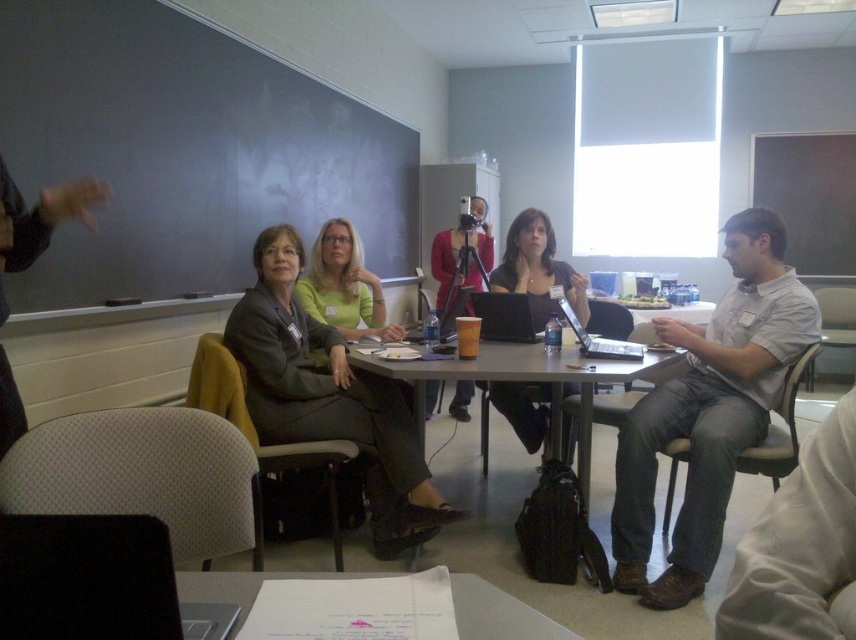
You are a photographer setting up for a group photo in the classroom. You need to ensure that the person wearing the matte gray suit at center and the person wearing the matte green shirt at center are both visible in the frame. Considering their heights, which of the two should be seated closer to the back to avoid blocking the view of the other?

The matte gray suit at center has a greater height compared to matte green shirt at center. Therefore, the person in the matte gray suit at center should be seated closer to the back to avoid blocking the view of the shorter person in the matte green shirt at center.

You are organizing a group activity and need to ensure everyone has enough space. The gray cotton shirt at right and the matte green shirt at center are seated at the table. Which participant might require more space due to their clothing size?

The gray cotton shirt at right requires more space because it is bigger than the matte green shirt at center.

You are a person standing at the entrance of the classroom. You need to reach the gray cotton shirt at right and the matte green shirt at center to hand out a document. Considering the distance between them, can you hand out the document to both without moving more than 1.5 meters from your current position?

The gray cotton shirt at right is 1.29 meters from the matte green shirt at center. Since the distance between them is less than 1.5 meters, you can hand out the document to both without moving more than 1.5 meters from your current position.